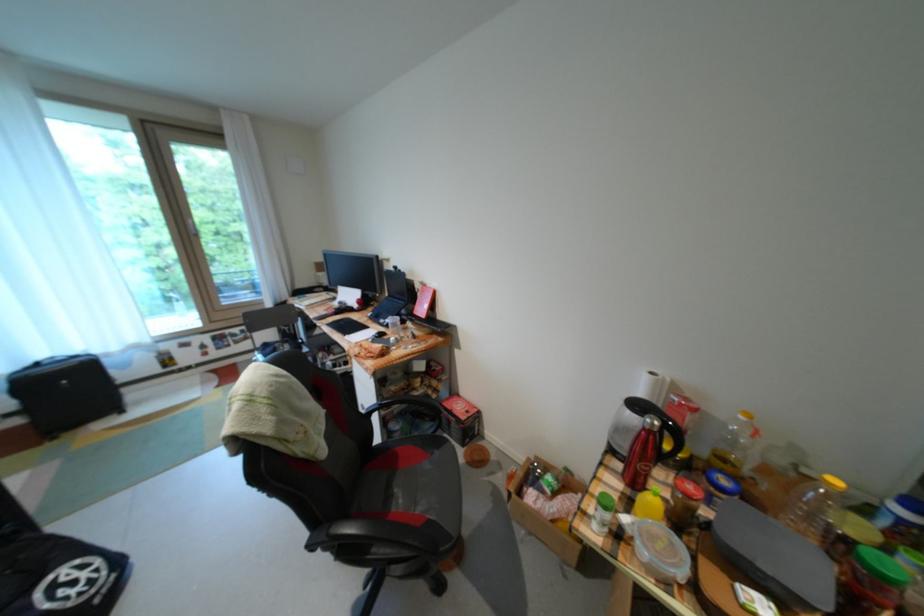
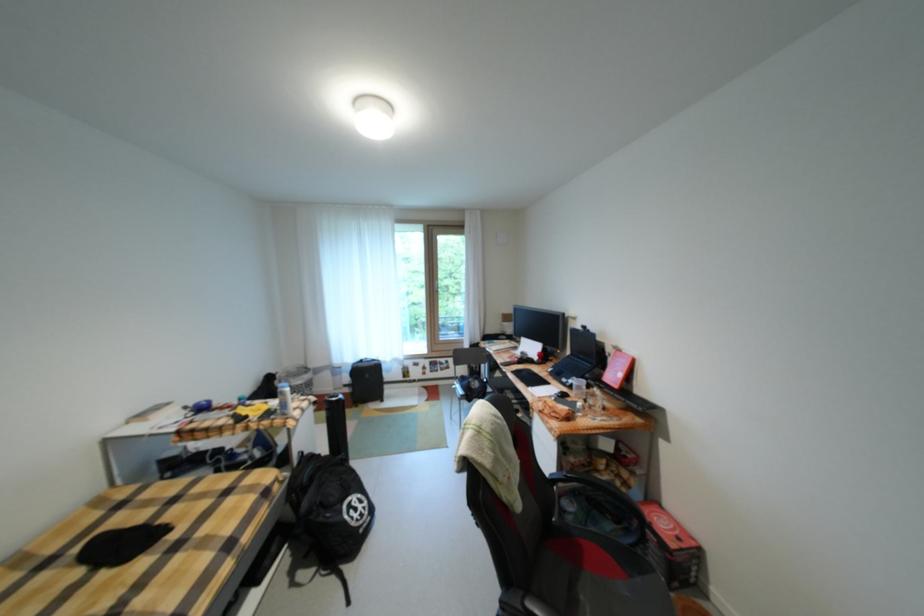
Question: The camera is either moving clockwise (left) or counter-clockwise (right) around the object. The first image is from the beginning of the video and the second image is from the end. Is the camera moving left or right when shooting the video?

Choices:
 (A) Left
 (B) Right

Answer: (B)